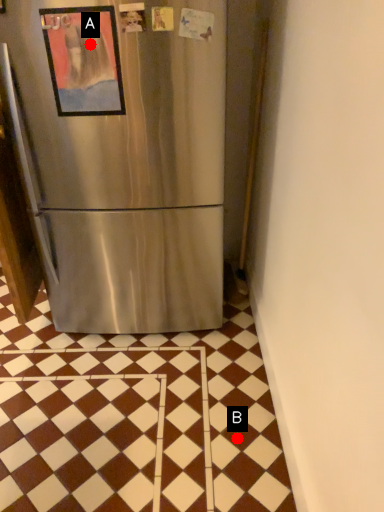
Question: Two points are circled on the image, labeled by A and B beside each circle. Which of the following is the farthest from the observer?

Choices:
 (A) A is further
 (B) B is further

Answer: (B)